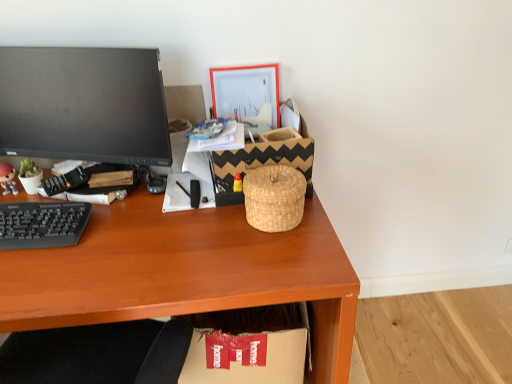
Where is `vacant space situated on the left part of woven natural basket at center`? The width and height of the screenshot is (512, 384). vacant space situated on the left part of woven natural basket at center is located at coordinates (208, 234).